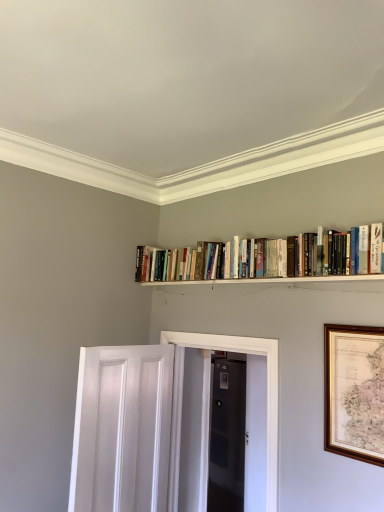
Question: Does wooden framed map at right lie behind white painted wood door at lower left, placed as the 2th door when sorted from back to front?

Choices:
 (A) no
 (B) yes

Answer: (A)

Question: Is white painted wood door at lower left, which is counted as the first door, starting from the front, inside wooden framed map at right?

Choices:
 (A) yes
 (B) no

Answer: (B)

Question: From a real-world perspective, is wooden framed map at right beneath white painted wood door at lower left, placed as the 1th door when sorted from left to right?

Choices:
 (A) yes
 (B) no

Answer: (B)

Question: From the image's perspective, does wooden framed map at right appear lower than white painted wood door at lower left, which is counted as the first door, starting from the front?

Choices:
 (A) no
 (B) yes

Answer: (A)

Question: Is wooden framed map at right outside white painted wood door at lower left, which is counted as the first door, starting from the front?

Choices:
 (A) yes
 (B) no

Answer: (A)

Question: Looking at their shapes, would you say white glossy elevator at center is wider or thinner than white painted wood door at lower left, which is counted as the 2th door, starting from the right?

Choices:
 (A) wide
 (B) thin

Answer: (A)

Question: From the image's perspective, is white glossy elevator at center above or below white painted wood door at lower left, which is counted as the first door, starting from the front?

Choices:
 (A) below
 (B) above

Answer: (A)

Question: Is white glossy elevator at center taller or shorter than white painted wood door at lower left, placed as the 1th door when sorted from left to right?

Choices:
 (A) tall
 (B) short

Answer: (A)

Question: Would you say white glossy elevator at center is to the left or to the right of white painted wood door at lower left, placed as the 1th door when sorted from left to right, in the picture?

Choices:
 (A) right
 (B) left

Answer: (A)

Question: Based on their sizes in the image, would you say black glossy door at center, which is counted as the 2th door, starting from the front, is bigger or smaller than white glossy elevator at center?

Choices:
 (A) small
 (B) big

Answer: (A)

Question: Would you say black glossy door at center, the first door in the right-to-left sequence, is to the left or to the right of white glossy elevator at center in the picture?

Choices:
 (A) right
 (B) left

Answer: (A)

Question: In terms of width, does black glossy door at center, which is counted as the 2th door, starting from the front, look wider or thinner when compared to white glossy elevator at center?

Choices:
 (A) thin
 (B) wide

Answer: (A)

Question: Is point (210, 479) positioned closer to the camera than point (248, 346)?

Choices:
 (A) closer
 (B) farther

Answer: (B)

Question: Considering the positions of white painted wood door at lower left, placed as the 2th door when sorted from back to front, and white wooden shelf at upper center in the image, is white painted wood door at lower left, placed as the 2th door when sorted from back to front, taller or shorter than white wooden shelf at upper center?

Choices:
 (A) tall
 (B) short

Answer: (A)

Question: In terms of width, does white painted wood door at lower left, which is counted as the 2th door, starting from the right, look wider or thinner when compared to white wooden shelf at upper center?

Choices:
 (A) wide
 (B) thin

Answer: (A)